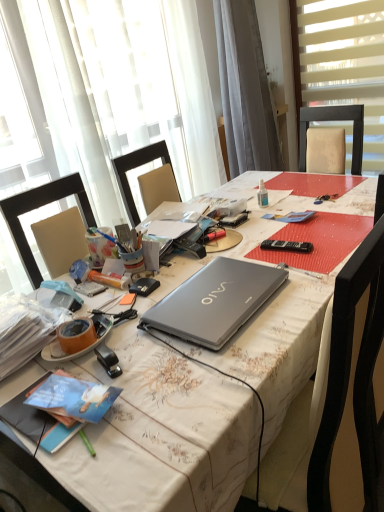
Identify the location of free point to the right of clear plastic bottle at center. The width and height of the screenshot is (384, 512). (296, 197).